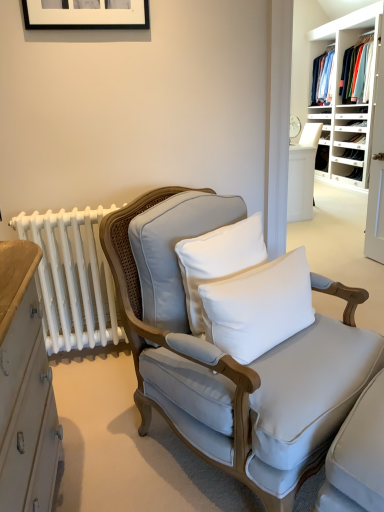
Question: From a real-world perspective, is white wood shelves at upper right positioned under black matte picture frame at upper center based on gravity?

Choices:
 (A) no
 (B) yes

Answer: (B)

Question: Is white wood shelves at upper right not near black matte picture frame at upper center?

Choices:
 (A) yes
 (B) no

Answer: (A)

Question: Is white wood shelves at upper right taller than black matte picture frame at upper center?

Choices:
 (A) no
 (B) yes

Answer: (B)

Question: From the image's perspective, is white wood shelves at upper right below black matte picture frame at upper center?

Choices:
 (A) no
 (B) yes

Answer: (A)

Question: Is white wood shelves at upper right to the right of black matte picture frame at upper center from the viewer's perspective?

Choices:
 (A) yes
 (B) no

Answer: (A)

Question: Is point (324, 74) closer or farther from the camera than point (235, 224)?

Choices:
 (A) farther
 (B) closer

Answer: (A)

Question: Which is correct: blue cotton shirt at upper right is inside white cotton pillow at center, positioned as the 2th pillow in right-to-left order, or outside of it?

Choices:
 (A) inside
 (B) outside

Answer: (B)

Question: From the image's perspective, is blue cotton shirt at upper right above or below white cotton pillow at center, positioned as the 2th pillow in right-to-left order?

Choices:
 (A) below
 (B) above

Answer: (B)

Question: In terms of width, does blue cotton shirt at upper right look wider or thinner when compared to white cotton pillow at center, positioned as the 2th pillow in right-to-left order?

Choices:
 (A) thin
 (B) wide

Answer: (B)

Question: Is light gray fabric chair at center bigger or smaller than blue cotton shirt at upper right?

Choices:
 (A) small
 (B) big

Answer: (B)

Question: From a real-world perspective, is light gray fabric chair at center physically located above or below blue cotton shirt at upper right?

Choices:
 (A) above
 (B) below

Answer: (B)

Question: In the image, is light gray fabric chair at center on the left side or the right side of blue cotton shirt at upper right?

Choices:
 (A) left
 (B) right

Answer: (A)

Question: Is light gray fabric chair at center in front of or behind blue cotton shirt at upper right in the image?

Choices:
 (A) front
 (B) behind

Answer: (A)

Question: In terms of size, does white cotton pillow at center, positioned as the first pillow in right-to-left order, appear bigger or smaller than black matte picture frame at upper center?

Choices:
 (A) small
 (B) big

Answer: (B)

Question: In terms of width, does white cotton pillow at center, which is counted as the second pillow, starting from the left, look wider or thinner when compared to black matte picture frame at upper center?

Choices:
 (A) thin
 (B) wide

Answer: (B)